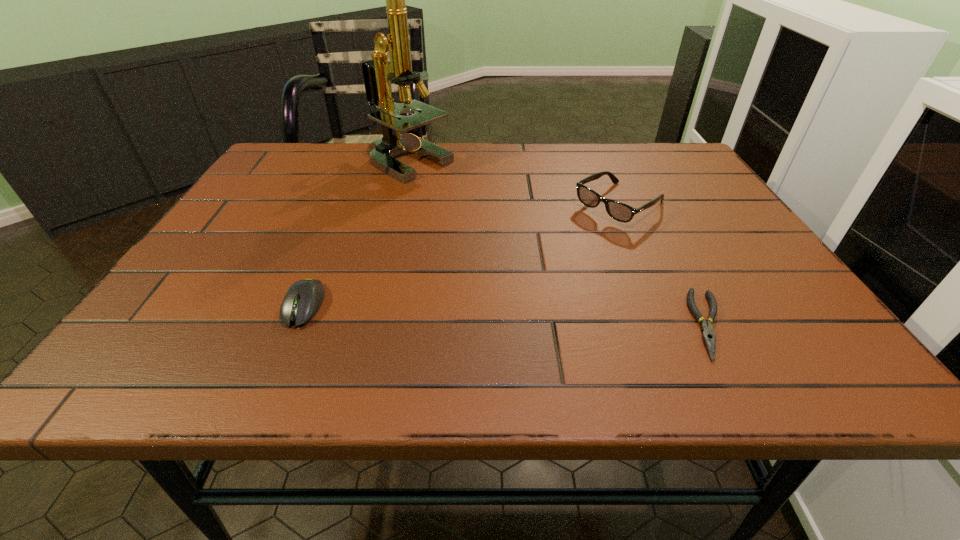
The width and height of the screenshot is (960, 540). Find the location of `vacant region between the second tallest object and the shortest object`. vacant region between the second tallest object and the shortest object is located at coordinates (x=664, y=265).

At what (x,y) coordinates should I click in order to perform the action: click on free point between the shortest object and the second tallest object. Please return your answer as a coordinate pair (x, y). The image size is (960, 540). Looking at the image, I should click on (664, 265).

The height and width of the screenshot is (540, 960). Identify the location of vacant space in between the pliers and the third shortest object. (664, 265).

Find the location of `object that is the second closest to the shortest object`. object that is the second closest to the shortest object is located at coordinates (377, 72).

Identify which object is the nearest to the microscope. Please provide its 2D coordinates. Your answer should be formatted as a tuple, i.e. [(x, y)], where the tuple contains the x and y coordinates of a point satisfying the conditions above.

[(621, 212)]

Where is `vacant position in the image that satisfies the following two spatial constraints: 1. on the front side of the shortest object; 2. on the left side of the spectacles`? vacant position in the image that satisfies the following two spatial constraints: 1. on the front side of the shortest object; 2. on the left side of the spectacles is located at coordinates (672, 324).

Find the location of a particular element. This screenshot has height=540, width=960. free space in the image that satisfies the following two spatial constraints: 1. on the front side of the spectacles; 2. on the right side of the microscope is located at coordinates (396, 206).

You are a GUI agent. You are given a task and a screenshot of the screen. Output one action in this format:
    pyautogui.click(x=<x>, y=<y>)
    Task: Click on the free space that satisfies the following two spatial constraints: 1. on the wheel side of the pliers; 2. on the right side of the second shortest object
    
    Given the screenshot: What is the action you would take?
    pyautogui.click(x=296, y=324)

You are a GUI agent. You are given a task and a screenshot of the screen. Output one action in this format:
    pyautogui.click(x=<x>, y=<y>)
    Task: Click on the free spot that satisfies the following two spatial constraints: 1. on the wheel side of the pliers; 2. on the right side of the computer mouse
    
    Given the screenshot: What is the action you would take?
    pyautogui.click(x=296, y=324)